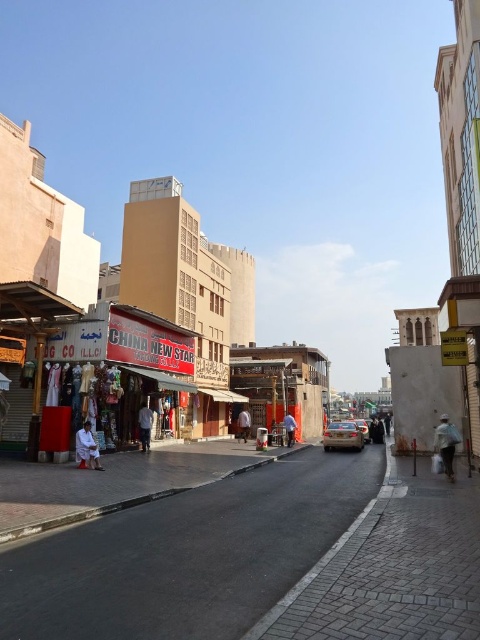
Can you confirm if white fabric bag at lower right is smaller than orange fabric at center?

No.

Based on the photo, is white fabric bag at lower right taller than orange fabric at center?

Yes.

You are a GUI agent. You are given a task and a screenshot of the screen. Output one action in this format:
    pyautogui.click(x=<x>, y=<y>)
    Task: Click on the white fabric bag at lower right
    
    Given the screenshot: What is the action you would take?
    pyautogui.click(x=446, y=444)

Does white cotton shirt at center come behind brown fabric person at center?

No, it is not.

The height and width of the screenshot is (640, 480). Identify the location of white cotton shirt at center. (144, 426).

Locate an element on the screen. Image resolution: width=480 pixels, height=640 pixels. white cotton shirt at center is located at coordinates (144, 426).

Does white fabric person at lower left appear over white cotton shirt at center?

Correct, white fabric person at lower left is located above white cotton shirt at center.

Can you confirm if white fabric person at lower left is taller than white cotton shirt at center?

Incorrect, white fabric person at lower left's height is not larger of white cotton shirt at center's.

This screenshot has width=480, height=640. Find the location of `white fabric person at lower left`. white fabric person at lower left is located at coordinates (86, 449).